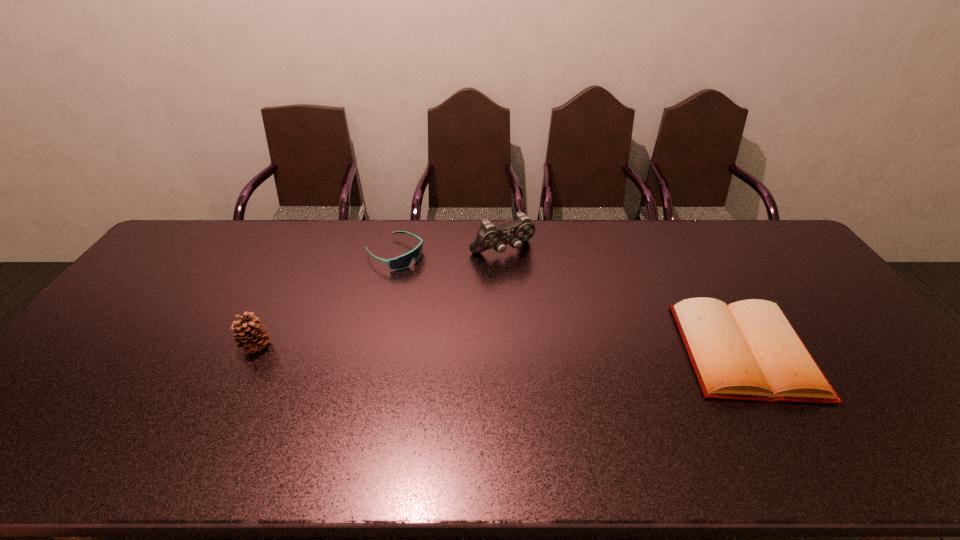
The height and width of the screenshot is (540, 960). Identify the location of vacant region at the right edge of the desktop. (900, 374).

Where is `free space at the near right corner`? free space at the near right corner is located at coordinates point(923,406).

Where is `vacant space in between the second shortest object and the Bible`? Image resolution: width=960 pixels, height=540 pixels. vacant space in between the second shortest object and the Bible is located at coordinates pyautogui.click(x=570, y=302).

In order to click on free space between the rightmost object and the second shortest object in this screenshot , I will do `click(570, 302)`.

Locate an element on the screen. The image size is (960, 540). vacant space in between the shortest object and the control is located at coordinates (623, 301).

Locate an element on the screen. Image resolution: width=960 pixels, height=540 pixels. vacant point located between the control and the sunglasses is located at coordinates (448, 252).

In order to click on vacant area between the third tallest object and the pinecone in this screenshot , I will do `click(325, 300)`.

Where is `vacant region between the second object from right to left and the third tallest object`? This screenshot has width=960, height=540. vacant region between the second object from right to left and the third tallest object is located at coordinates (448, 252).

In order to click on empty location between the third object from left to right and the third object from right to left in this screenshot , I will do `click(448, 252)`.

This screenshot has height=540, width=960. In order to click on free spot between the Bible and the third object from left to right in this screenshot , I will do `click(623, 301)`.